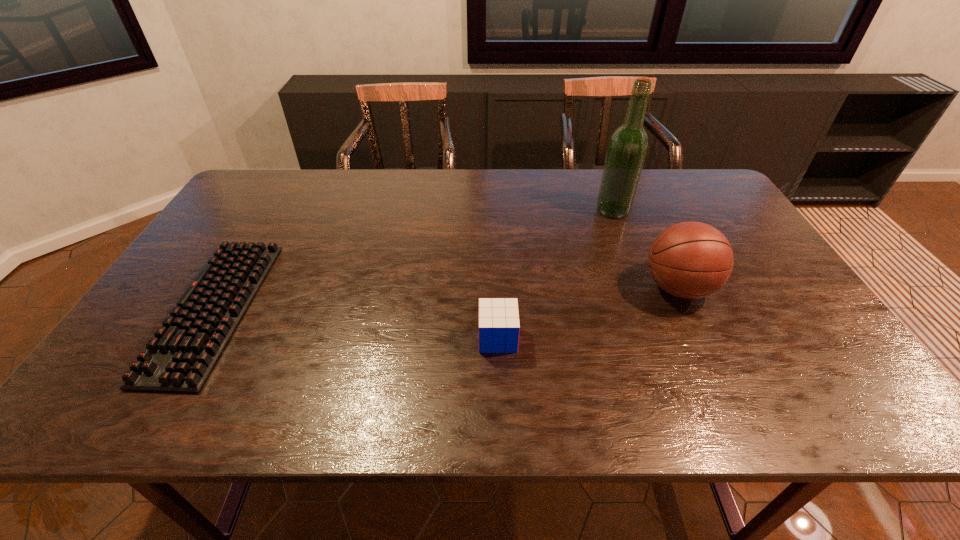
Identify the location of the farthest object. (628, 145).

Identify the location of liquor. The image size is (960, 540). (628, 145).

Find the location of `the third shortest object`. the third shortest object is located at coordinates (x=690, y=260).

Identify the location of the second object from left to right. (499, 327).

Locate an element on the screen. This screenshot has width=960, height=540. cube is located at coordinates (499, 327).

What are the coordinates of `computer keyboard` in the screenshot? It's located at (180, 358).

You are a GUI agent. You are given a task and a screenshot of the screen. Output one action in this format:
    pyautogui.click(x=<x>, y=<y>)
    Task: Click on the leftmost object
    
    Given the screenshot: What is the action you would take?
    pyautogui.click(x=180, y=358)

Where is `free space located 0.370m on the left of the tallest object`? This screenshot has width=960, height=540. free space located 0.370m on the left of the tallest object is located at coordinates (480, 210).

Locate an element on the screen. vacant region located on the back of the basketball is located at coordinates (649, 225).

Find the location of a particular element. The width and height of the screenshot is (960, 540). vacant space located on the front of the third object from right to left is located at coordinates (499, 383).